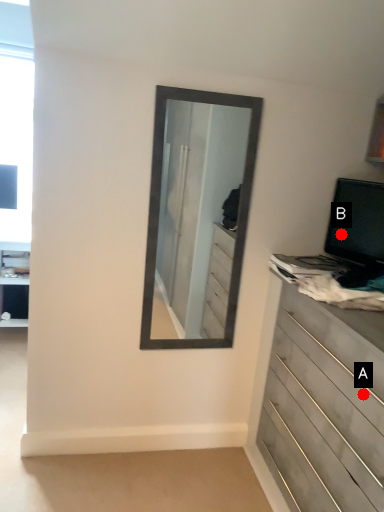
Question: Two points are circled on the image, labeled by A and B beside each circle. Which point is further to the camera?

Choices:
 (A) A is further
 (B) B is further

Answer: (B)